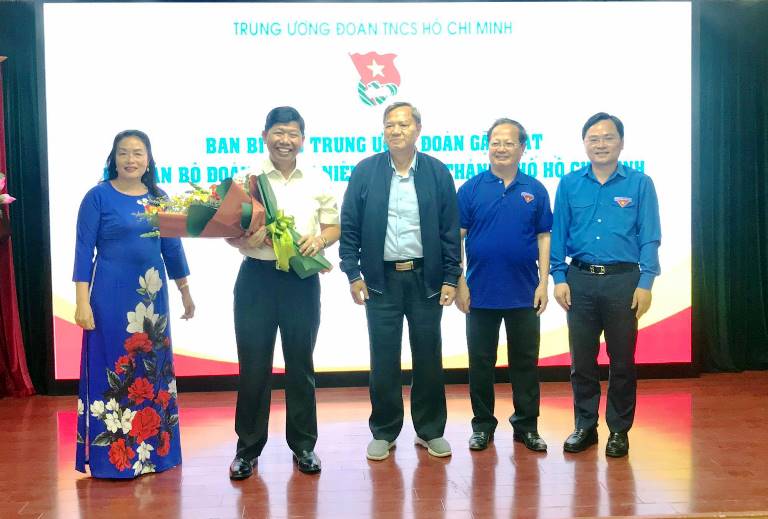
Where is `wood floor`? wood floor is located at coordinates (458, 502).